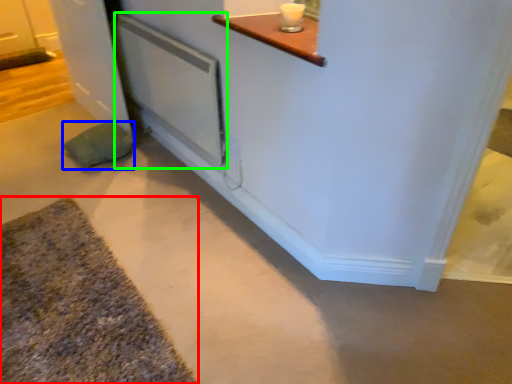
Question: Considering the real-world distances, which object is farthest from bath mat (highlighted by a red box)? pillow (highlighted by a blue box) or screen door (highlighted by a green box)?

Choices:
 (A) pillow
 (B) screen door

Answer: (B)